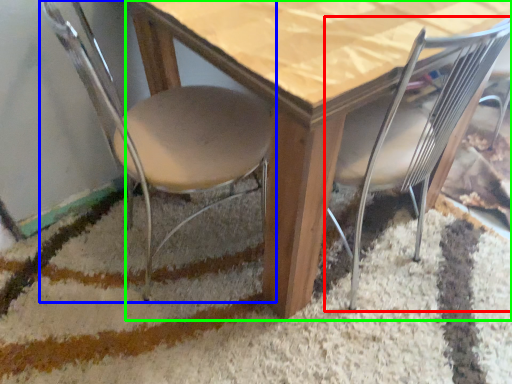
Question: Estimate the real-world distances between objects in this image. Which object is farther from chair (highlighted by a red box), chair (highlighted by a blue box) or table (highlighted by a green box)?

Choices:
 (A) chair
 (B) table

Answer: (A)